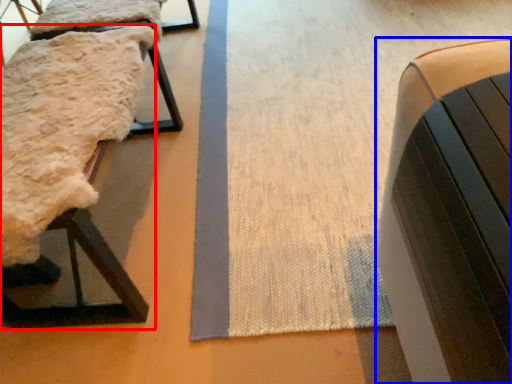
Question: Which point is further to the camera, furniture (highlighted by a red box) or furniture (highlighted by a blue box)?

Choices:
 (A) furniture
 (B) furniture

Answer: (A)